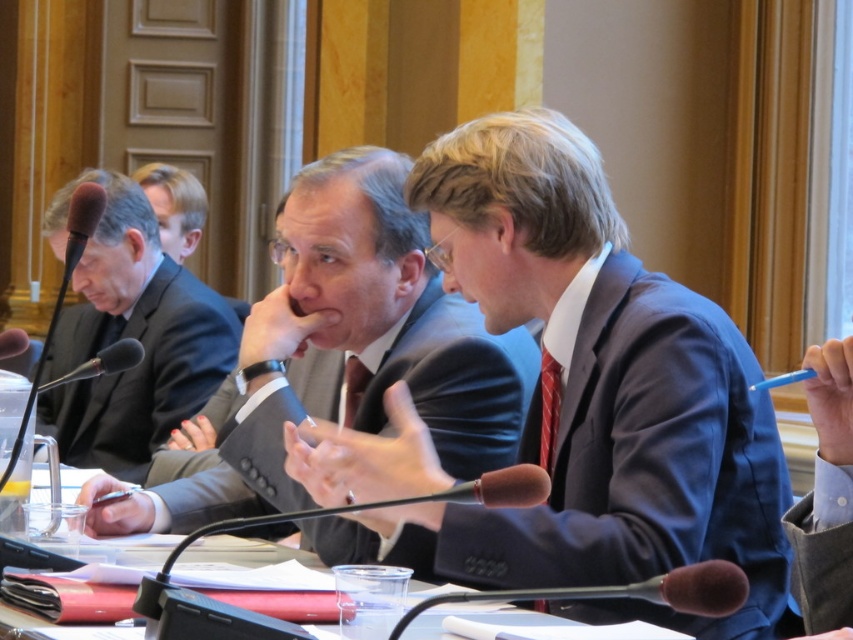
Which is below, dark gray suit at center or black matte suit at left?

dark gray suit at center

Who is more forward, (479, 321) or (151, 406)?

Point (479, 321) is more forward.

Is point (181, 515) farther from viewer compared to point (74, 416)?

No, it is in front of (74, 416).

Where is `dark gray suit at center`? dark gray suit at center is located at coordinates (456, 381).

Is blue suit at center bigger than dark gray suit at center?

Actually, blue suit at center might be smaller than dark gray suit at center.

Which of these two, blue suit at center or dark gray suit at center, stands taller?

blue suit at center

Where is `blue suit at center`? This screenshot has height=640, width=853. blue suit at center is located at coordinates tap(602, 387).

Does point (573, 400) lie behind point (67, 344)?

No, it is in front of (67, 344).

Is blue suit at center bigger than black matte suit at left?

Incorrect, blue suit at center is not larger than black matte suit at left.

Which is in front, point (450, 244) or point (170, 291)?

Point (450, 244)

Find the location of a particular element. blue suit at center is located at coordinates [602, 387].